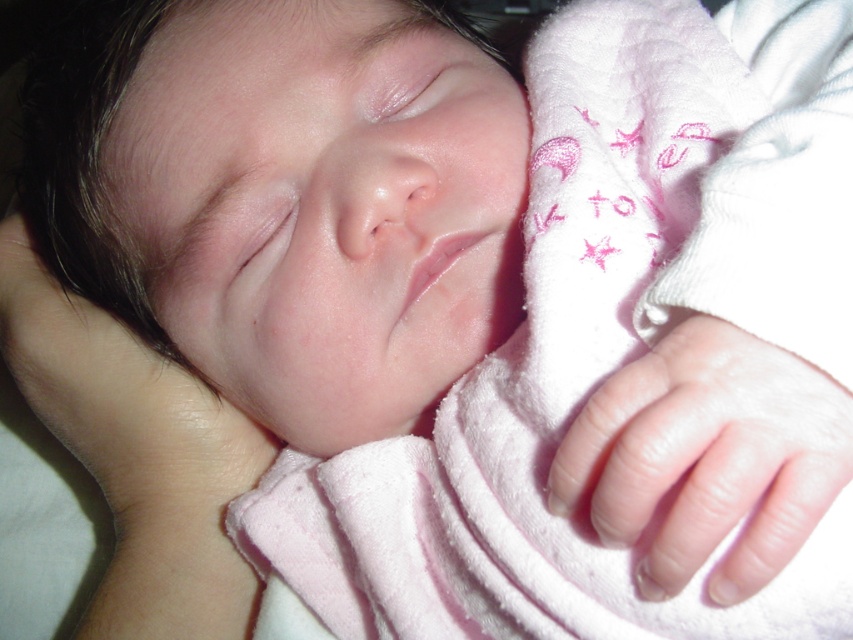
Question: Which point appears farthest from the camera in this image?

Choices:
 (A) (322, 186)
 (B) (647, 396)
 (C) (722, 48)
 (D) (181, 440)

Answer: (D)

Question: Does smooth skin baby at center lie in front of smooth skin hand at lower left?

Choices:
 (A) yes
 (B) no

Answer: (A)

Question: Which point is closer to the camera taking this photo?

Choices:
 (A) (338, 172)
 (B) (601, 451)

Answer: (B)

Question: From the image, what is the correct spatial relationship of pink soft blanket at center in relation to smooth skin hand at lower right?

Choices:
 (A) above
 (B) below

Answer: (A)

Question: Which of the following is the farthest from the observer?

Choices:
 (A) smooth skin hand at lower left
 (B) pink soft blanket at center
 (C) smooth skin hand at lower right

Answer: (A)

Question: Is smooth skin baby at center to the right of smooth skin hand at lower left from the viewer's perspective?

Choices:
 (A) yes
 (B) no

Answer: (A)